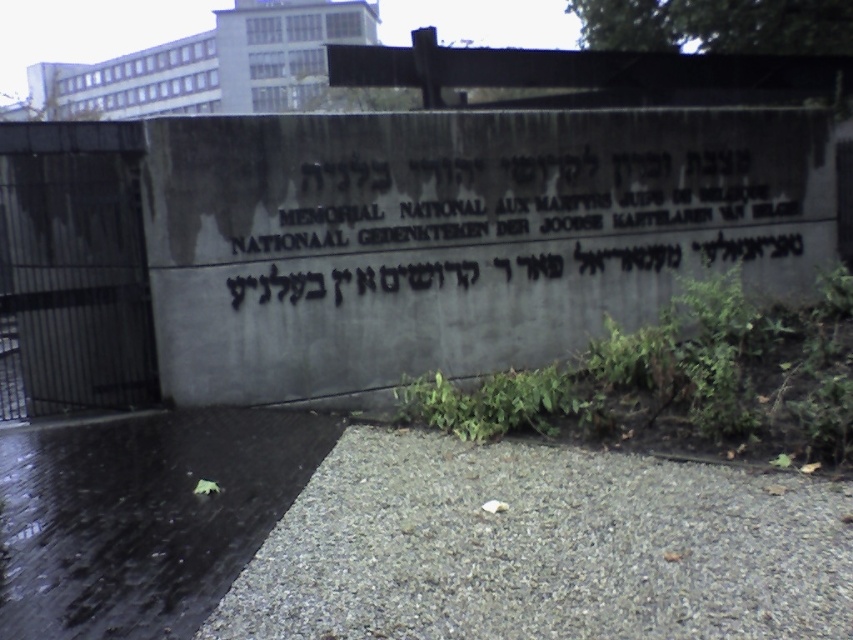
Question: Can you confirm if dark gray stone sign at center is positioned to the left of green leafy plant at lower right?

Choices:
 (A) yes
 (B) no

Answer: (A)

Question: Does dark gray stone sign at center have a larger size compared to green leafy plant at lower right?

Choices:
 (A) yes
 (B) no

Answer: (B)

Question: Which of the following is the closest to the observer?

Choices:
 (A) (305, 259)
 (B) (453, 401)

Answer: (B)

Question: Does dark gray stone sign at center come behind green leafy plant at lower right?

Choices:
 (A) no
 (B) yes

Answer: (B)